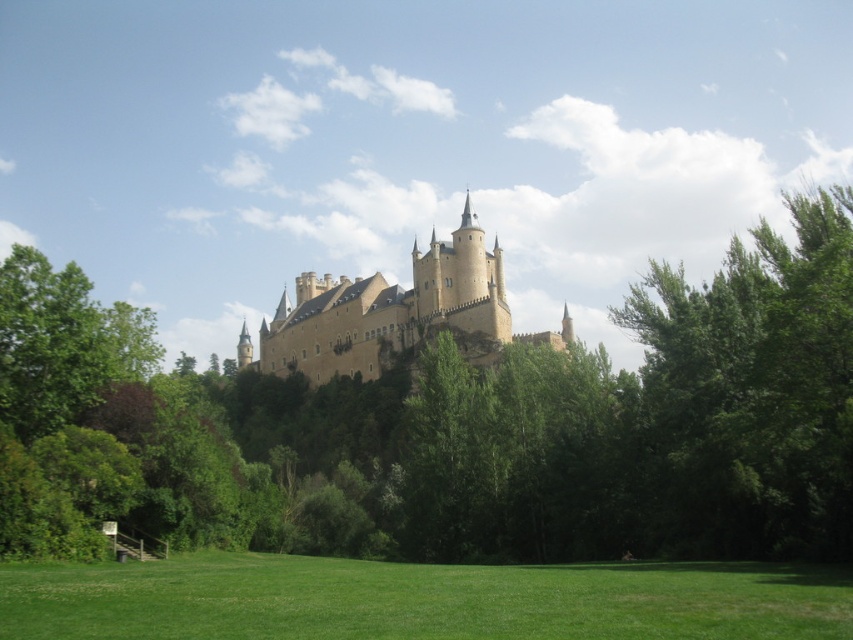
Question: Which object is farther from the camera taking this photo?

Choices:
 (A) brown stone castle at center
 (B) green leafy tree at center

Answer: (A)

Question: Which object is positioned closest to the brown stone castle at center?

Choices:
 (A) green leafy tree at right
 (B) green leafy tree at center

Answer: (B)

Question: Does green grass at lower center appear on the left side of brown stone castle at center?

Choices:
 (A) yes
 (B) no

Answer: (B)

Question: Can you confirm if green leafy tree at right is smaller than green grass at lower center?

Choices:
 (A) no
 (B) yes

Answer: (A)

Question: Where is green leafy tree at center located in relation to green leafy tree at right in the image?

Choices:
 (A) below
 (B) above

Answer: (A)

Question: Which object appears farthest from the camera in this image?

Choices:
 (A) brown stone castle at center
 (B) green leafy tree at center
 (C) green leafy tree at right

Answer: (A)